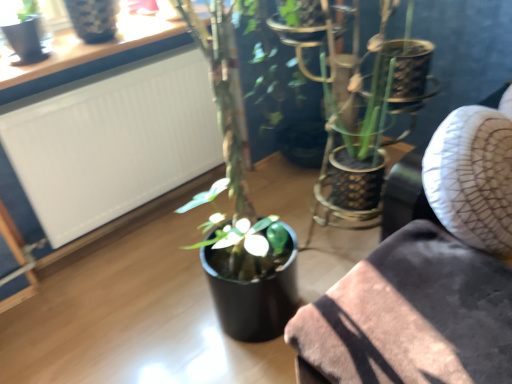
Question: Should I look upward or downward to see matte black pot at center?

Choices:
 (A) up
 (B) down

Answer: (B)